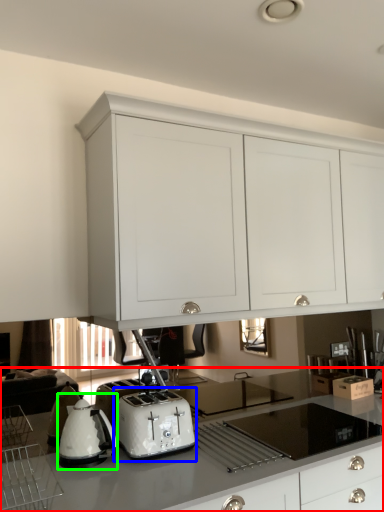
Question: Which object is positioned farthest from countertop (highlighted by a red box)? Select from toaster (highlighted by a blue box) and home appliance (highlighted by a green box).

Choices:
 (A) toaster
 (B) home appliance

Answer: (B)